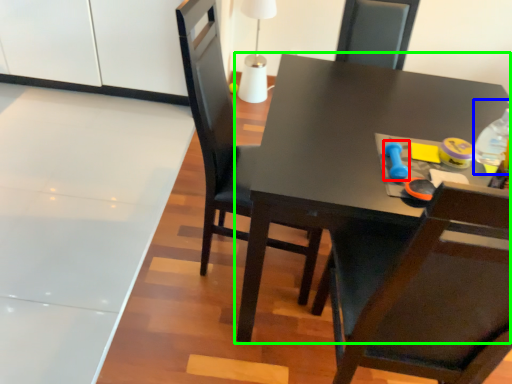
Question: Which is farther away from toy (highlighted by a red box)? bottle (highlighted by a blue box) or table (highlighted by a green box)?

Choices:
 (A) bottle
 (B) table

Answer: (B)